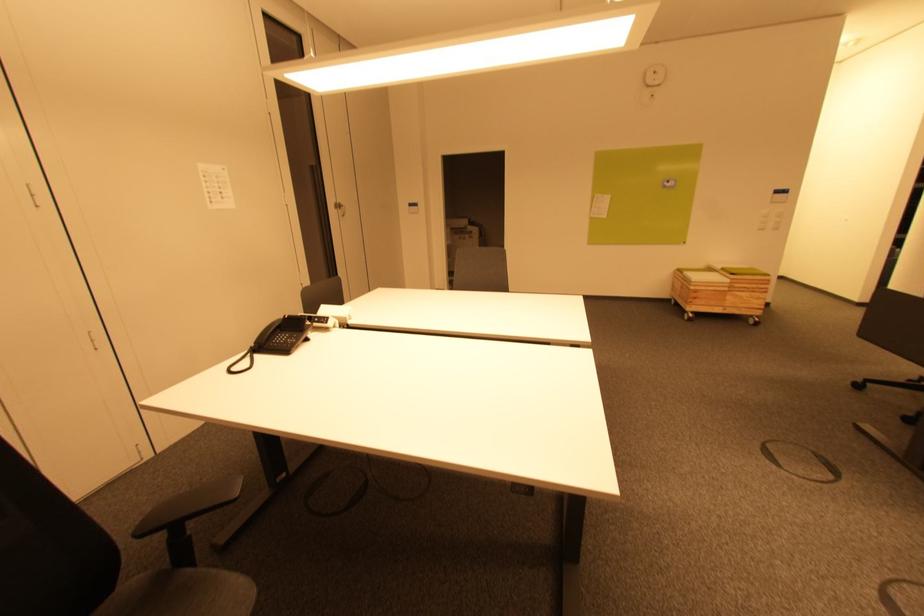
This screenshot has width=924, height=616. Find the location of `loop cabinet handle`. loop cabinet handle is located at coordinates (339, 208).